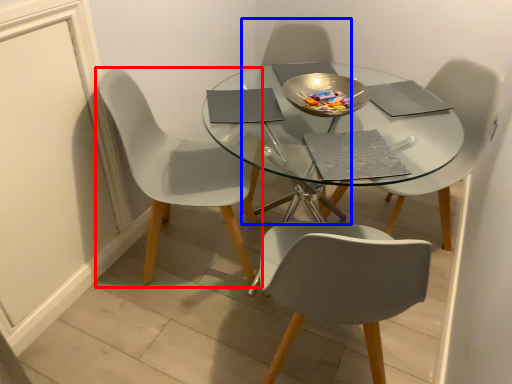
Question: Which point is closer to the camera, chair (highlighted by a red box) or chair (highlighted by a blue box)?

Choices:
 (A) chair
 (B) chair

Answer: (A)